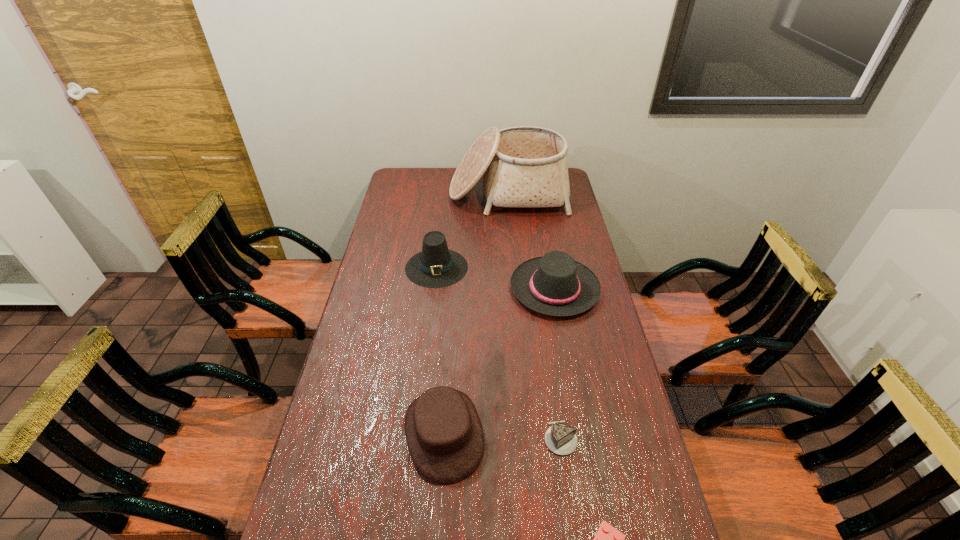
At what (x,y) coordinates should I click in order to perform the action: click on free point located on the right of the shortest hat. Please return your answer as a coordinate pair (x, y). This screenshot has width=960, height=540. Looking at the image, I should click on (503, 433).

Image resolution: width=960 pixels, height=540 pixels. Identify the location of free spot located 0.180m on the back of the chocolate cake. (550, 369).

The height and width of the screenshot is (540, 960). I want to click on object located at the far edge, so click(525, 166).

Find the location of a particular element. The image size is (960, 540). object that is at the left edge is located at coordinates (436, 266).

Locate an element on the screen. This screenshot has height=540, width=960. basket that is at the right edge is located at coordinates (525, 166).

Locate an element on the screen. dress hat situated at the right edge is located at coordinates pos(554,284).

Image resolution: width=960 pixels, height=540 pixels. Identify the location of object positioned at the far right corner. pos(525,166).

Identify the location of vacant area at the far edge. (450, 178).

The width and height of the screenshot is (960, 540). Find the location of `vacant space at the left edge`. vacant space at the left edge is located at coordinates (399, 245).

Image resolution: width=960 pixels, height=540 pixels. Identify the location of free space at the right edge. (591, 436).